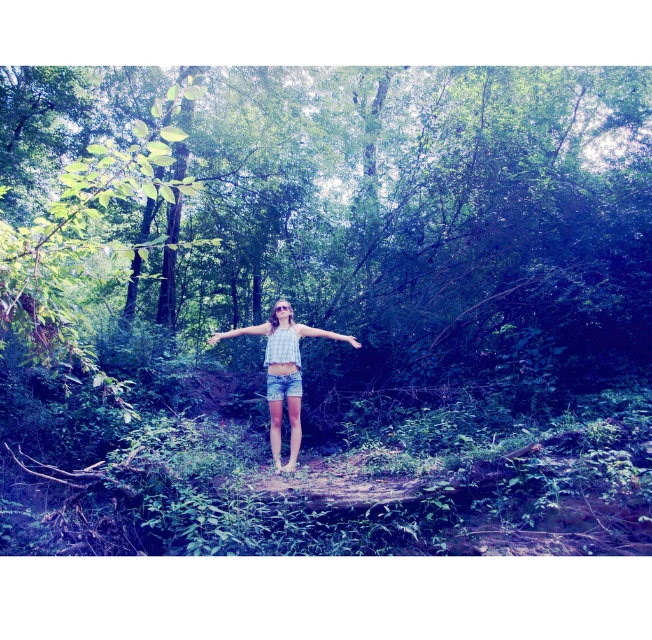
You are a photographer trying to capture the person in the forest scene. You notice the white fabric arm at center and the blue fabric hand at center. Which object should you focus on to ensure the other is visible in the background?

The white fabric arm at center is in front of the blue fabric hand at center. To have the blue fabric hand at center visible in the background, focus on the white fabric arm at center.

You are a photographer trying to capture the person in the forest scene. You notice the checkered fabric blouse at center and the smooth skin hand at center. Which object would require you to focus on a closer detail to capture its texture effectively?

The smooth skin hand at center requires closer detail focus because it is smaller in size than the checkered fabric blouse at center.